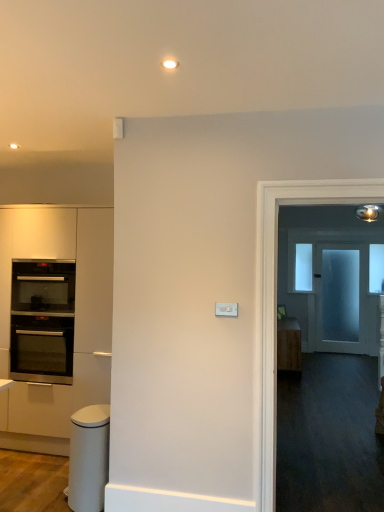
Question: Considering the relative positions of transparent glass window at upper center, the first window when ordered from left to right, and white glossy trash can at lower left in the image provided, is transparent glass window at upper center, the first window when ordered from left to right, to the left of white glossy trash can at lower left from the viewer's perspective?

Choices:
 (A) no
 (B) yes

Answer: (A)

Question: Would you say white glossy trash can at lower left is part of transparent glass window at upper center, placed as the 1th window when sorted from back to front,'s contents?

Choices:
 (A) yes
 (B) no

Answer: (B)

Question: Does transparent glass window at upper center, the 2th window positioned from the front, lie behind white glossy trash can at lower left?

Choices:
 (A) yes
 (B) no

Answer: (A)

Question: Is transparent glass window at upper center, the first window when ordered from left to right, at the right side of white glossy trash can at lower left?

Choices:
 (A) no
 (B) yes

Answer: (B)

Question: Considering the relative sizes of transparent glass window at upper center, the first window when ordered from left to right, and white glossy trash can at lower left in the image provided, is transparent glass window at upper center, the first window when ordered from left to right, wider than white glossy trash can at lower left?

Choices:
 (A) yes
 (B) no

Answer: (B)

Question: From their relative heights in the image, would you say stainless steel oven at left, positioned as the 2th oven in top-to-bottom order, is taller or shorter than wooden cabinet at right, which appears as the second cabinetry when viewed from the left?

Choices:
 (A) tall
 (B) short

Answer: (B)

Question: Choose the correct answer: Is stainless steel oven at left, positioned as the 1th oven in bottom-to-top order, inside wooden cabinet at right, the first cabinetry when ordered from right to left, or outside it?

Choices:
 (A) outside
 (B) inside

Answer: (A)

Question: From the image's perspective, relative to wooden cabinet at right, the first cabinetry when ordered from right to left, is stainless steel oven at left, positioned as the 2th oven in top-to-bottom order, above or below?

Choices:
 (A) above
 (B) below

Answer: (A)

Question: Is point (34, 284) closer or farther from the camera than point (294, 331)?

Choices:
 (A) closer
 (B) farther

Answer: (A)

Question: From the image's perspective, is matte white cabinetry at left, the first cabinetry in the left-to-right sequence, above or below frosted glass door at right?

Choices:
 (A) above
 (B) below

Answer: (A)

Question: Is matte white cabinetry at left, the first cabinetry in the left-to-right sequence, taller or shorter than frosted glass door at right?

Choices:
 (A) short
 (B) tall

Answer: (A)

Question: Does point (105, 276) appear closer or farther from the camera than point (334, 331)?

Choices:
 (A) closer
 (B) farther

Answer: (A)

Question: Do you think matte white cabinetry at left, the 2th cabinetry viewed from the right, is within frosted glass door at right, or outside of it?

Choices:
 (A) outside
 (B) inside

Answer: (A)

Question: Would you say transparent glass window at upper center, which is the 2th window from right to left, is inside or outside transparent glass window at upper right, marked as the 1th window in a right-to-left arrangement?

Choices:
 (A) inside
 (B) outside

Answer: (B)

Question: Is transparent glass window at upper center, the 2th window positioned from the front, to the left or to the right of transparent glass window at upper right, which is the first window from front to back, in the image?

Choices:
 (A) right
 (B) left

Answer: (B)